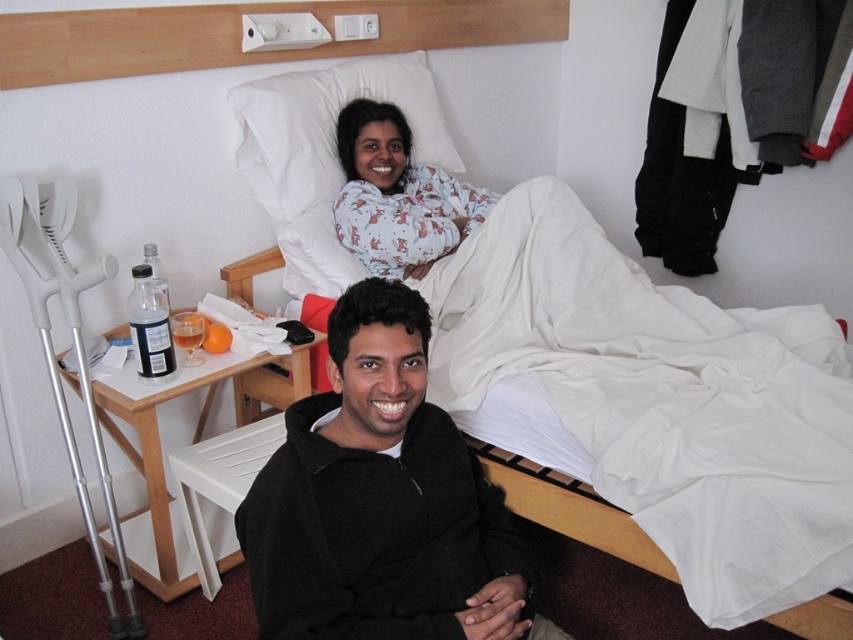
Is black fleece at lower center closer to camera compared to printed cotton pajamas at upper center?

Yes, it is.

Who is more distant from viewer, (346, 596) or (434, 182)?

→ Positioned behind is point (434, 182).

Image resolution: width=853 pixels, height=640 pixels. I want to click on black fleece at lower center, so click(x=380, y=500).

Between white fabric hospital bed at center and printed cotton pajamas at upper center, which one is positioned higher?

printed cotton pajamas at upper center is higher up.

Is white fabric hospital bed at center taller than printed cotton pajamas at upper center?

Yes.

Does point (543, 316) come closer to viewer compared to point (350, 122)?

Yes, it is.

You are a GUI agent. You are given a task and a screenshot of the screen. Output one action in this format:
    pyautogui.click(x=<x>, y=<y>)
    Task: Click on the white fabric hospital bed at center
    The height and width of the screenshot is (640, 853).
    Given the screenshot: What is the action you would take?
    pyautogui.click(x=656, y=401)

Is white fabric hospital bed at center closer to camera compared to white soft pillow at upper center?

Yes, it is in front of white soft pillow at upper center.

Who is more forward, (627, 483) or (283, 170)?

Positioned in front is point (627, 483).

The image size is (853, 640). Find the location of `white fabric hospital bed at center`. white fabric hospital bed at center is located at coordinates (x=656, y=401).